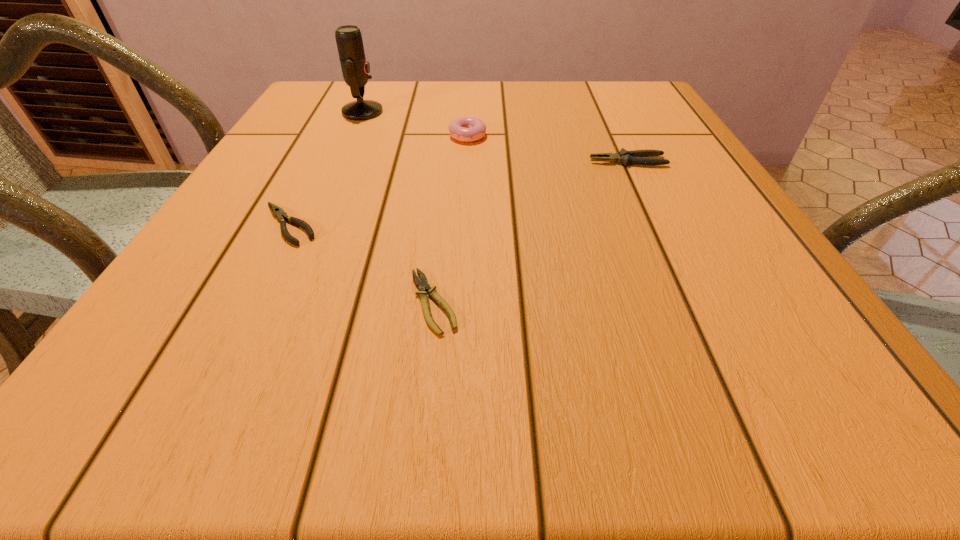
I want to click on object that is at the right edge, so click(625, 157).

The image size is (960, 540). I want to click on object present at the far left corner, so click(x=355, y=68).

Identify the location of vacant region at the far edge of the desktop. click(x=380, y=95).

Where is `vacant space at the near edge`? vacant space at the near edge is located at coordinates (553, 422).

Image resolution: width=960 pixels, height=540 pixels. Find the location of `free space at the left edge`. free space at the left edge is located at coordinates (301, 119).

In the image, there is a desktop. Identify the location of blank space at the right edge. (748, 278).

What are the coordinates of `vacant space at the near left corner of the desktop` in the screenshot? It's located at [155, 378].

Identify the location of vacant area at the far right corner of the desktop. This screenshot has height=540, width=960. (649, 112).

This screenshot has width=960, height=540. In order to click on free space between the rightmost object and the farthest object in this screenshot , I will do `click(495, 137)`.

At what (x,y) coordinates should I click in order to perform the action: click on blank region between the farthest pliers and the nearest object. Please return your answer as a coordinate pair (x, y). Looking at the image, I should click on (531, 232).